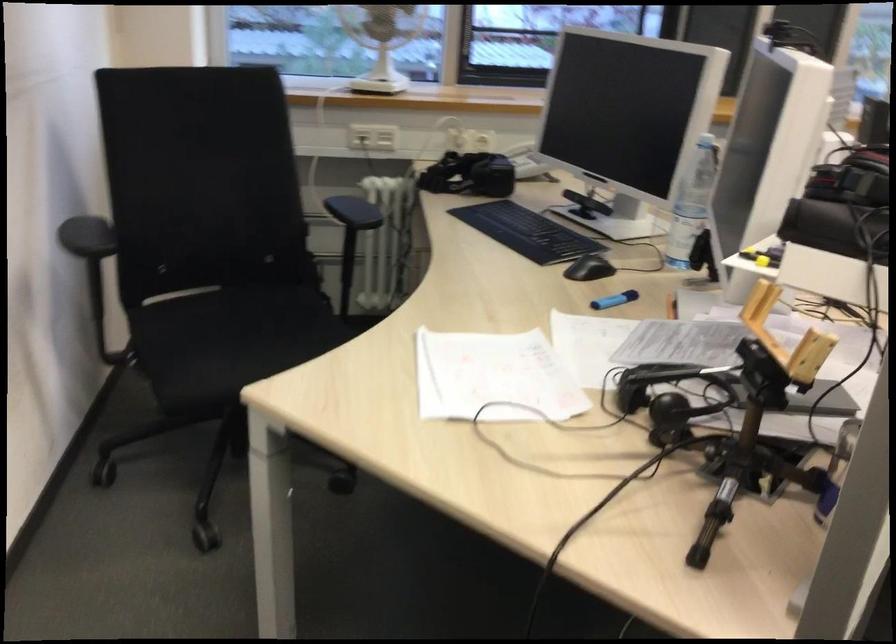
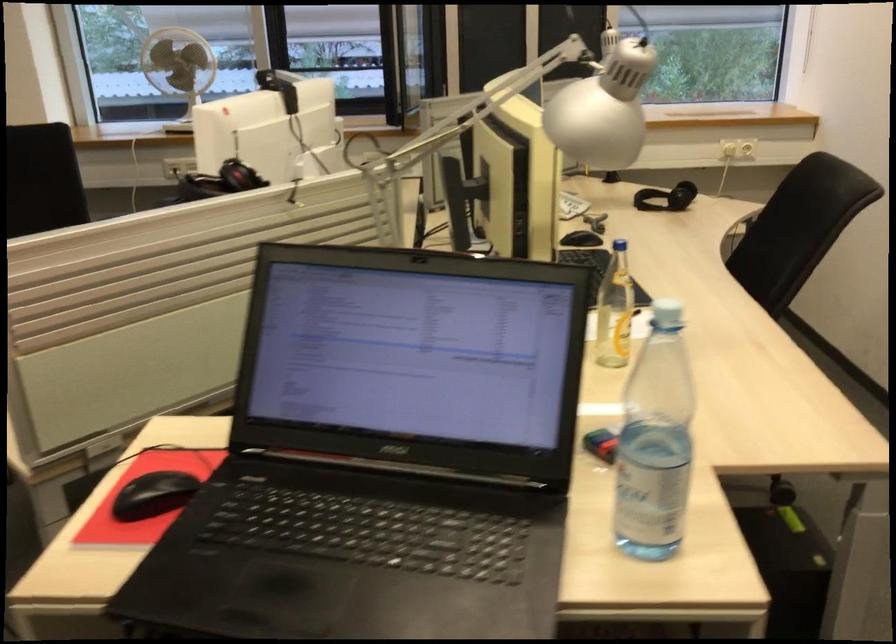
What movement of the cameraman would produce the second image?

The movement direction of the cameraman is right, backward.